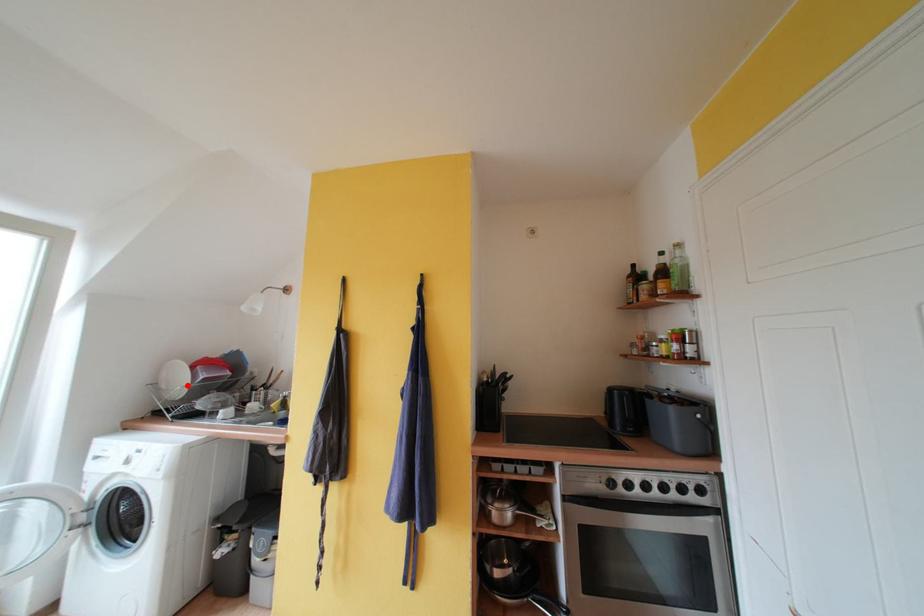
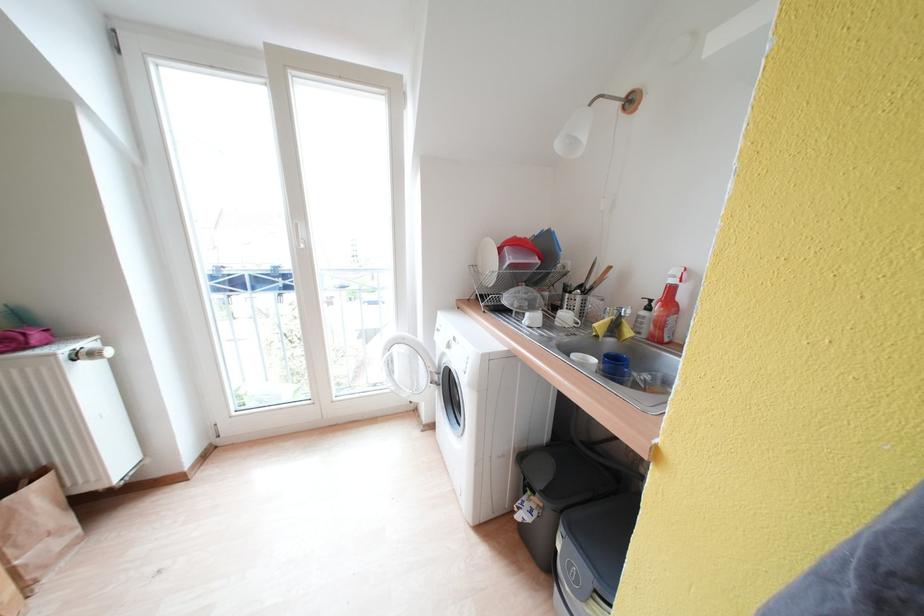
Find the pixel in the second image that matches the highlighted location in the first image.

(497, 270)